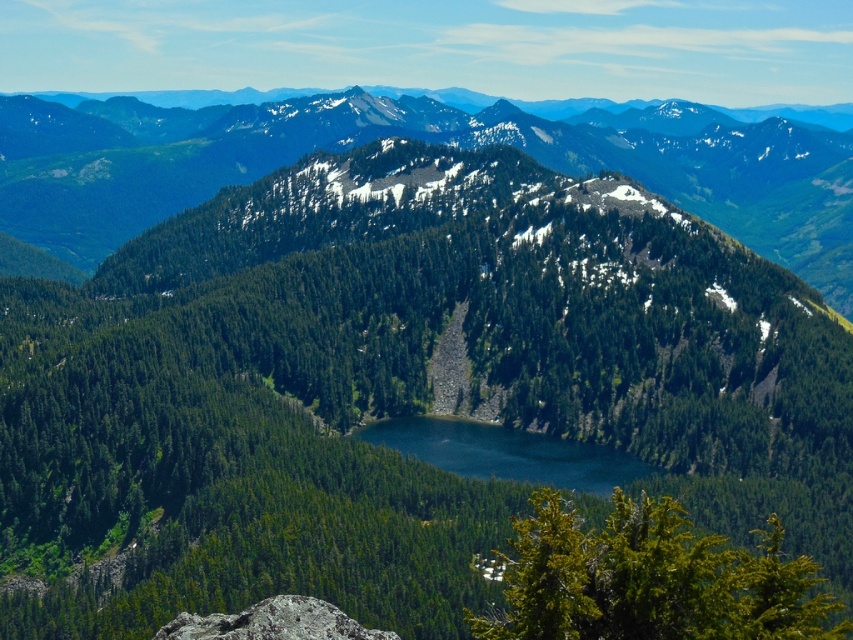
From the picture: You are a hiker standing at the bottom left corner of the image near the rocky outcrop. You want to reach the deep blue water at center. Which direction should you head towards, and will the green forested mountain at center block your path?

The deep blue water at center is behind the green forested mountain at center, so you should head towards the center of the image. However, the green forested mountain at center will block your path to the deep blue water at center.

You are a hiker planning to climb the green forested mountain at center and the deep blue water at center. Which one is taller?

The green forested mountain at center is taller than the deep blue water at center.